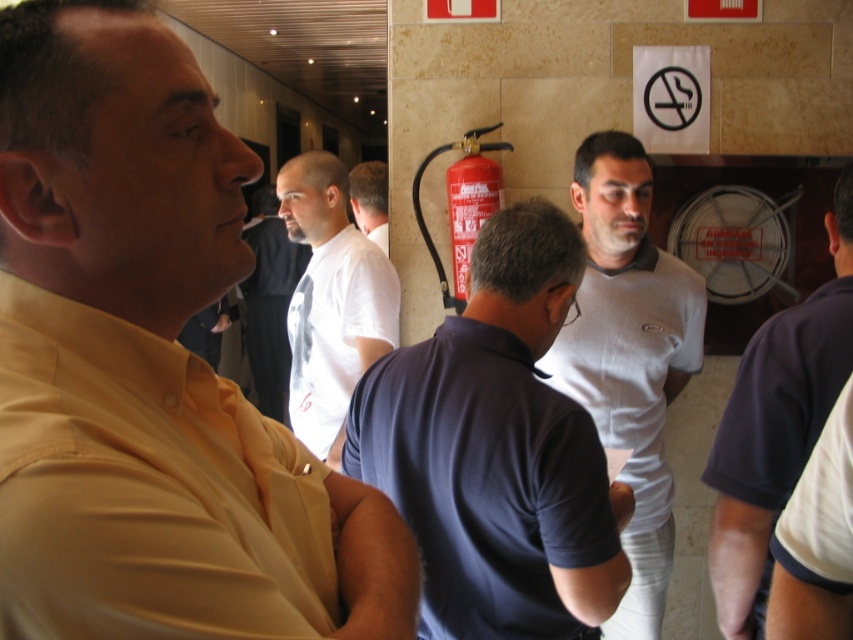
At what (x,y) coordinates should I click in order to perform the action: click on white matte shirt at center. Please return your answer as a coordinate pair (x, y). This screenshot has height=640, width=853. Looking at the image, I should click on (331, 301).

Who is lower down, white matte shirt at center or white cotton shirt at center?

Positioned lower is white matte shirt at center.

Is point (309, 321) more distant than point (265, 323)?

No, it is not.

I want to click on white matte shirt at center, so click(x=331, y=301).

Between white matte shirt at center and red matte fire extinguisher at center, which one appears on the right side from the viewer's perspective?

From the viewer's perspective, red matte fire extinguisher at center appears more on the right side.

Between point (331, 417) and point (451, 268), which one is positioned in front?

Point (331, 417) is in front.

The image size is (853, 640). What are the coordinates of `white matte shirt at center` in the screenshot? It's located at (331, 301).

In order to click on white matte shirt at center in this screenshot , I will do `click(331, 301)`.

Which is in front, point (44, 51) or point (460, 436)?

Point (44, 51)

Between matte yellow shirt at center and dark blue polo shirt at center, which one appears on the right side from the viewer's perspective?

dark blue polo shirt at center

Is point (109, 515) more distant than point (578, 502)?

That is False.

This screenshot has width=853, height=640. Identify the location of matte yellow shirt at center. (149, 368).